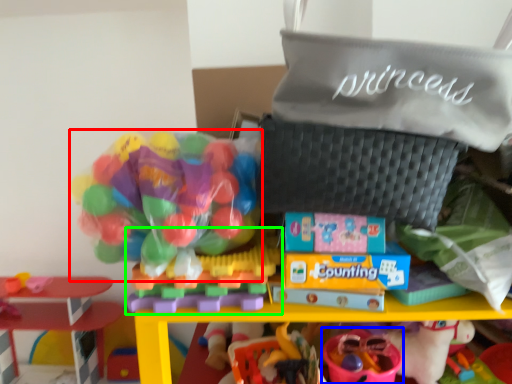
Question: Which object is the farthest from toy (highlighted by a red box)? Choose among these: toy (highlighted by a blue box) or toy (highlighted by a green box).

Choices:
 (A) toy
 (B) toy

Answer: (A)